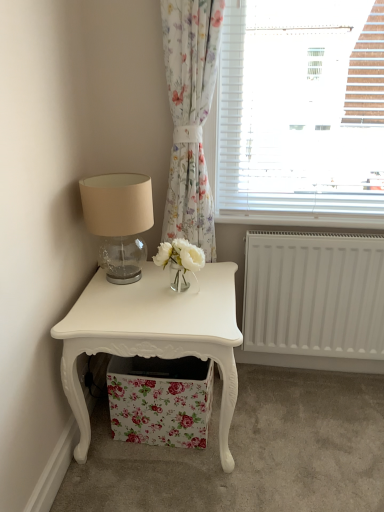
Find the location of `vacant area on top of white plastic radiator at lower center (from a real-world perspective)`. vacant area on top of white plastic radiator at lower center (from a real-world perspective) is located at coordinates click(x=303, y=214).